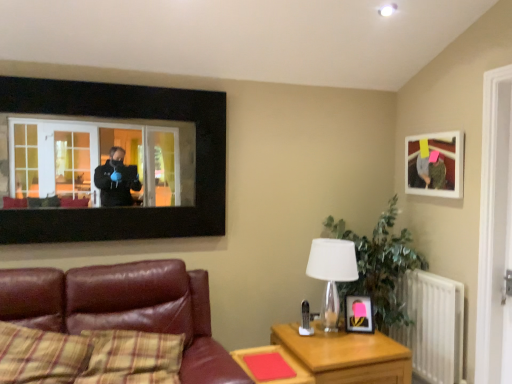
Question: Does point (186, 317) appear closer or farther from the camera than point (426, 178)?

Choices:
 (A) farther
 (B) closer

Answer: (B)

Question: From the image's perspective, relative to matte white picture frame at upper right, which ranks as the 1th picture frame in right-to-left order, is leather couch at lower left above or below?

Choices:
 (A) above
 (B) below

Answer: (B)

Question: Which object is the closest to the white metallic radiator at right?

Choices:
 (A) matte white picture frame at upper right, acting as the second picture frame starting from the bottom
 (B) green leafy plant at right
 (C) matte black picture frame at center, the first picture frame viewed from the left
 (D) black matte window frame at upper left
 (E) white glass table lamp at center right

Answer: (B)

Question: Which object is positioned closest to the white metallic radiator at right?

Choices:
 (A) leather couch at lower left
 (B) white glass table lamp at center right
 (C) matte black picture frame at center, the first picture frame from the bottom
 (D) wooden table at lower center, which is the first table in left-to-right order
 (E) black matte window frame at upper left

Answer: (C)